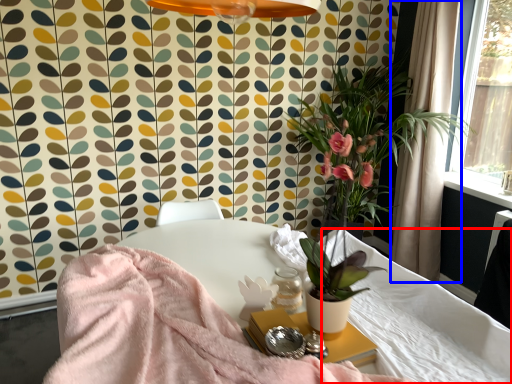
Question: Among these objects, which one is nearest to the camera, mattress (highlighted by a red box) or curtain (highlighted by a blue box)?

Choices:
 (A) mattress
 (B) curtain

Answer: (A)